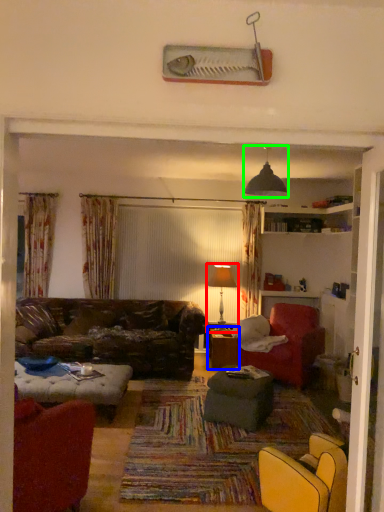
Question: Which is farther away from table lamp (highlighted by a red box)? table (highlighted by a blue box) or light fixture (highlighted by a green box)?

Choices:
 (A) table
 (B) light fixture

Answer: (B)